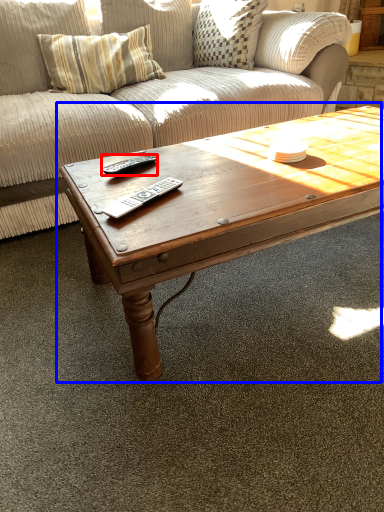
Question: Which object appears farthest to the camera in this image, remote (highlighted by a red box) or coffee table (highlighted by a blue box)?

Choices:
 (A) remote
 (B) coffee table

Answer: (A)